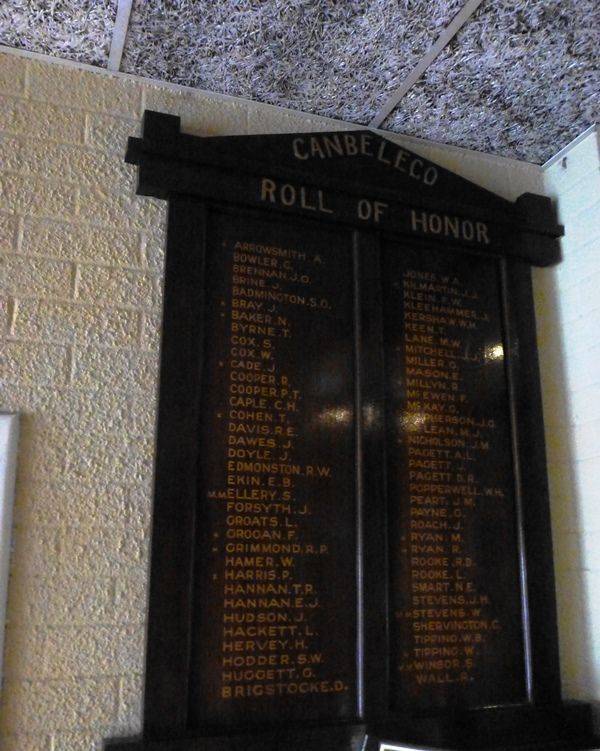
Image resolution: width=600 pixels, height=751 pixels. Find the location of `ceiling`. ceiling is located at coordinates (506, 101).